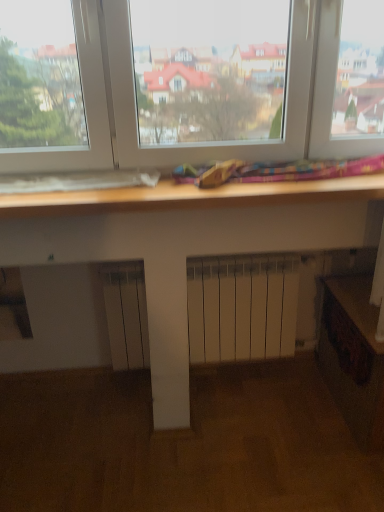
Find the location of `wooden at lower right`. wooden at lower right is located at coordinates [353, 357].

This screenshot has height=512, width=384. What do you see at coordinates (353, 357) in the screenshot?
I see `wooden at lower right` at bounding box center [353, 357].

The height and width of the screenshot is (512, 384). What do you see at coordinates (347, 341) in the screenshot? I see `wooden drawer at lower right` at bounding box center [347, 341].

Locate an element on the screen. The image size is (384, 512). wooden drawer at lower right is located at coordinates (347, 341).

Locate an element on the screen. This screenshot has width=384, height=512. wooden at lower right is located at coordinates (353, 357).

Considering the positions of objects wooden at lower right and wooden drawer at lower right in the image provided, who is more to the left, wooden at lower right or wooden drawer at lower right?

wooden drawer at lower right is more to the left.

Does wooden at lower right come in front of wooden drawer at lower right?

Yes, it is.

Which is in front, point (359, 320) or point (358, 348)?

The point (359, 320) is in front.

From the image's perspective, does wooden at lower right appear higher than wooden drawer at lower right?

No, from the image's perspective, wooden at lower right is not on top of wooden drawer at lower right.

From a real-world perspective, is wooden at lower right under wooden drawer at lower right?

Indeed, from a real-world perspective, wooden at lower right is positioned beneath wooden drawer at lower right.

Considering the relative sizes of wooden at lower right and wooden drawer at lower right in the image provided, is wooden at lower right wider than wooden drawer at lower right?

Indeed, wooden at lower right has a greater width compared to wooden drawer at lower right.

In the scene shown: From their relative heights in the image, would you say wooden at lower right is taller or shorter than wooden drawer at lower right?

Clearly, wooden at lower right is taller compared to wooden drawer at lower right.

Considering the relative sizes of wooden at lower right and wooden drawer at lower right in the image provided, is wooden at lower right smaller than wooden drawer at lower right?

Incorrect, wooden at lower right is not smaller in size than wooden drawer at lower right.

Is wooden at lower right inside the boundaries of wooden drawer at lower right, or outside?

wooden at lower right is outside wooden drawer at lower right.

Would you say wooden at lower right is a long distance from wooden drawer at lower right?

No, there isn't a large distance between wooden at lower right and wooden drawer at lower right.

Is wooden at lower right oriented away from wooden drawer at lower right?

wooden at lower right does not have its back to wooden drawer at lower right.

Can you tell me how much wooden at lower right and wooden drawer at lower right differ in facing direction?

90 degrees.

How much distance is there between wooden at lower right and wooden drawer at lower right?

wooden at lower right and wooden drawer at lower right are 1.98 inches apart.

Locate an element on the screen. The width and height of the screenshot is (384, 512). workbench below the wooden drawer at lower right (from the image's perspective) is located at coordinates (353, 357).

Is wooden drawer at lower right to the left or to the right of wooden at lower right in the image?

In the image, wooden drawer at lower right appears on the left side of wooden at lower right.

Is wooden drawer at lower right in front of wooden at lower right?

That is False.

Considering the points (336, 317) and (342, 348), which point is behind, point (336, 317) or point (342, 348)?

The point (336, 317) is more distant.

From the image's perspective, which one is positioned higher, wooden drawer at lower right or wooden at lower right?

From the image's view, wooden drawer at lower right is above.

From a real-world perspective, is wooden drawer at lower right positioned over wooden at lower right based on gravity?

Yes, from a real-world perspective, wooden drawer at lower right is above wooden at lower right.

Can you confirm if wooden drawer at lower right is wider than wooden at lower right?

In fact, wooden drawer at lower right might be narrower than wooden at lower right.

Does wooden drawer at lower right have a lesser height compared to wooden at lower right?

Indeed, wooden drawer at lower right has a lesser height compared to wooden at lower right.

Is wooden drawer at lower right smaller than wooden at lower right?

Yes, wooden drawer at lower right is smaller than wooden at lower right.

Is wooden drawer at lower right positioned beyond the bounds of wooden at lower right?

No.

Is wooden drawer at lower right in contact with wooden at lower right?

Absolutely, wooden drawer at lower right is next to and touching wooden at lower right.

Does wooden drawer at lower right turn towards wooden at lower right?

Yes, wooden drawer at lower right is oriented towards wooden at lower right.

How distant is wooden drawer at lower right from wooden at lower right?

wooden drawer at lower right and wooden at lower right are 1.98 inches apart from each other.

You are a GUI agent. You are given a task and a screenshot of the screen. Output one action in this format:
    pyautogui.click(x=<x>, y=<y>)
    Task: Click on the drawer above the wooden at lower right (from a real-world perspective)
    
    Given the screenshot: What is the action you would take?
    pyautogui.click(x=347, y=341)

The height and width of the screenshot is (512, 384). Find the location of `workbench below the wooden drawer at lower right (from a real-world perspective)`. workbench below the wooden drawer at lower right (from a real-world perspective) is located at coordinates (353, 357).

What are the coordinates of `workbench located in front of the wooden drawer at lower right` in the screenshot? It's located at (353, 357).